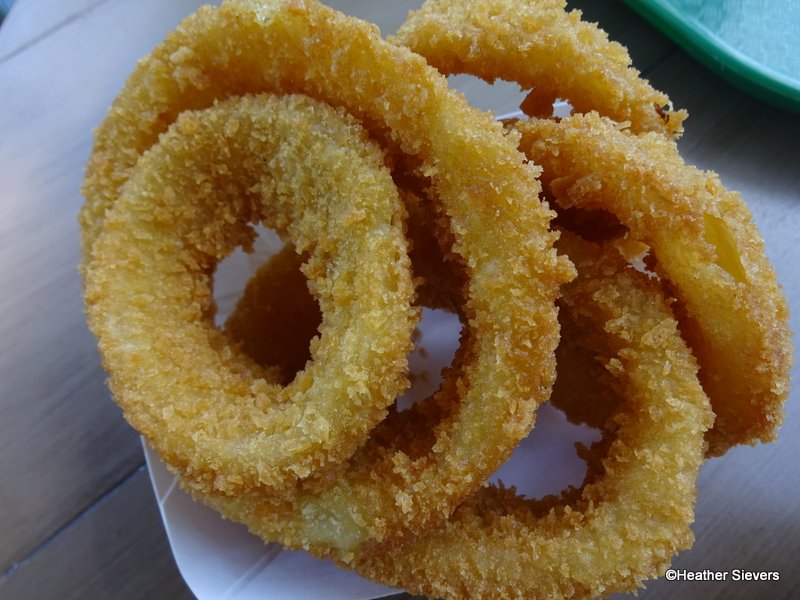
You are a GUI agent. You are given a task and a screenshot of the screen. Output one action in this format:
    pyautogui.click(x=<x>, y=<y>)
    Task: Click on the wooden table to right of snack
    The image size is (800, 600).
    Given the screenshot: What is the action you would take?
    coord(782,212)